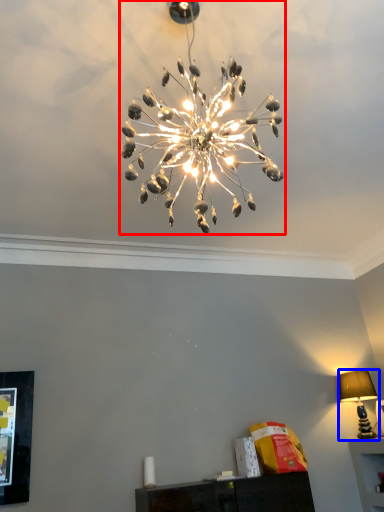
Question: Which object appears closest to the camera in this image, lamp (highlighted by a red box) or lamp (highlighted by a blue box)?

Choices:
 (A) lamp
 (B) lamp

Answer: (A)